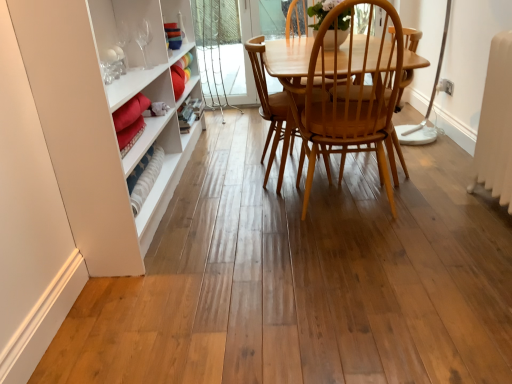
Locate an element on the screen. The height and width of the screenshot is (384, 512). vacant region below light brown wood chair at center (from a real-world perspective) is located at coordinates [281, 178].